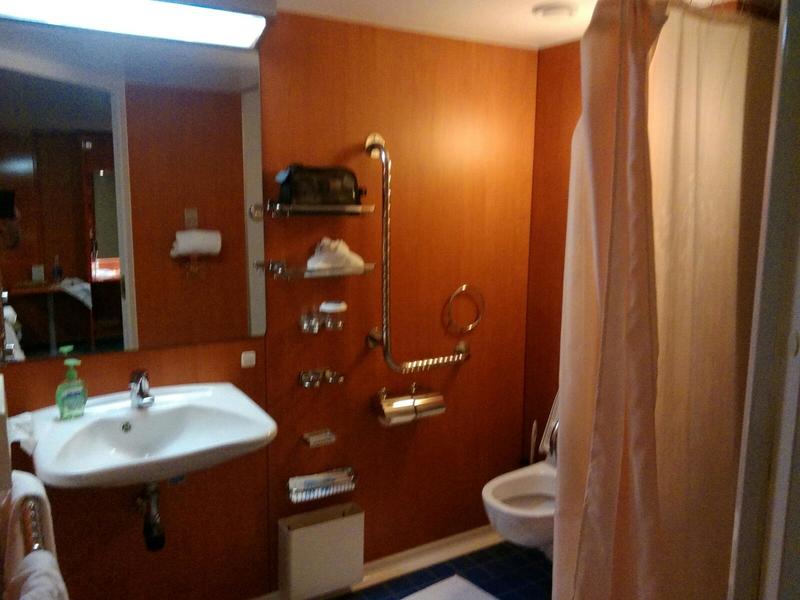
Find the location of a particular element. Image resolution: width=800 pixels, height=600 pixels. material shower curtain is located at coordinates (677, 123).